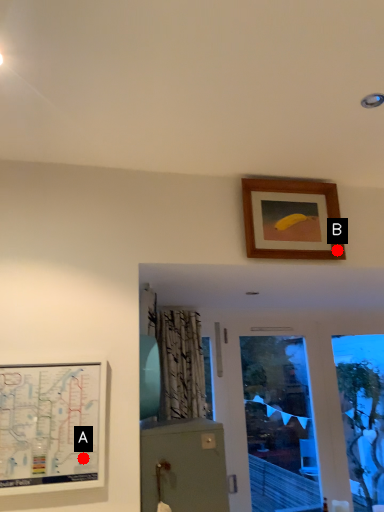
Question: Two points are circled on the image, labeled by A and B beside each circle. Which point is closer to the camera?

Choices:
 (A) A is closer
 (B) B is closer

Answer: (A)